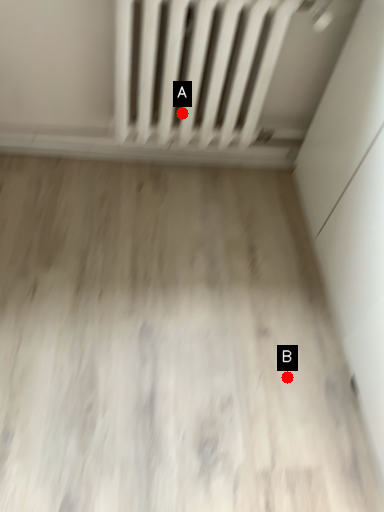
Question: Two points are circled on the image, labeled by A and B beside each circle. Which point is closer to the camera?

Choices:
 (A) A is closer
 (B) B is closer

Answer: (B)